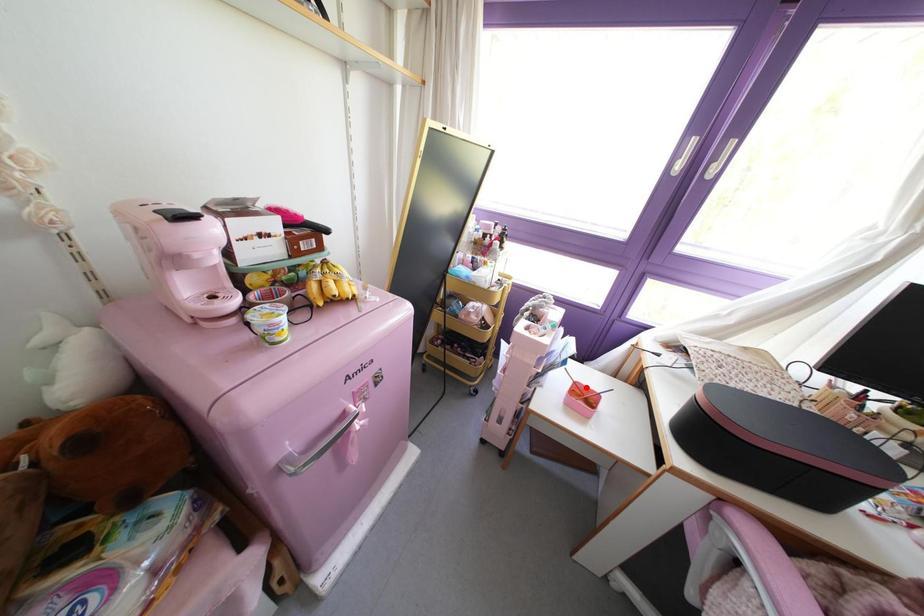
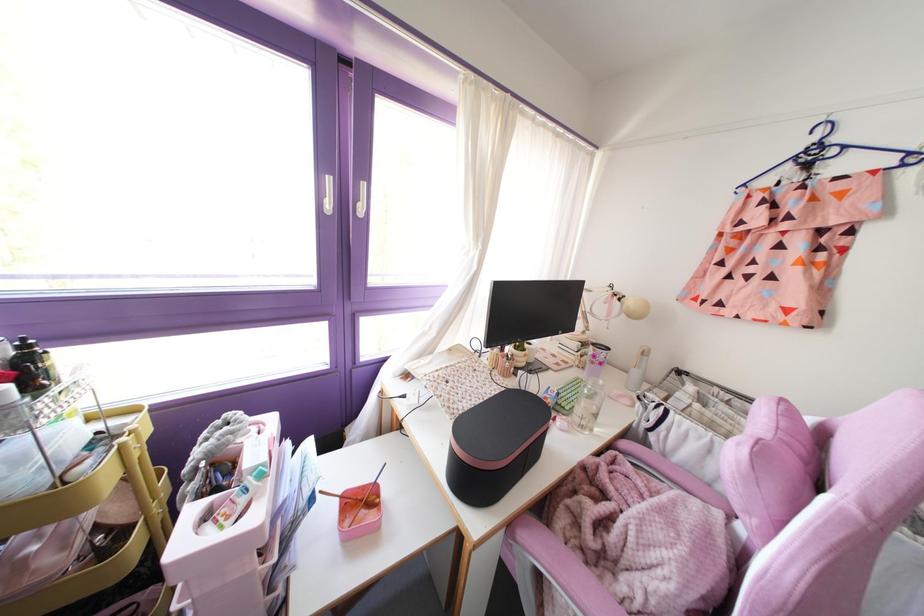
In the second image, find the point that corresponds to the highlighted location in the first image.

(359, 487)